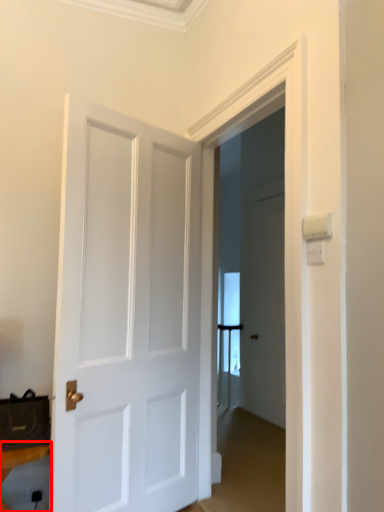
Question: From the image's perspective, what is the correct spatial relationship of furniture (annotated by the red box) in relation to door?

Choices:
 (A) above
 (B) below

Answer: (B)